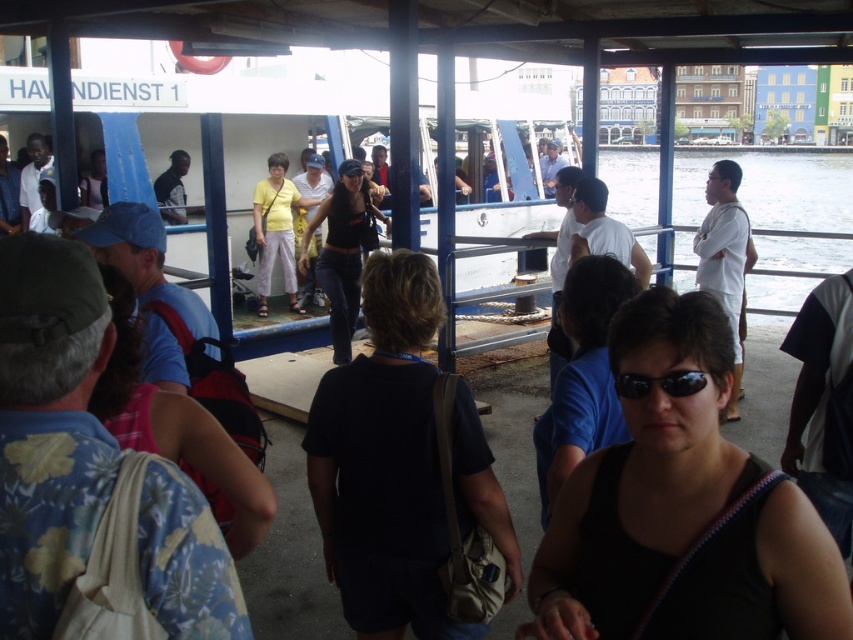
Question: Does floral shirt at left have a greater width compared to clear water at right?

Choices:
 (A) no
 (B) yes

Answer: (A)

Question: Which point is closer to the camera taking this photo?

Choices:
 (A) (113, 275)
 (B) (590, 275)
 (C) (630, 381)
 (D) (428, 324)

Answer: (C)

Question: Among these objects, which one is nearest to the camera?

Choices:
 (A) floral shirt at center
 (B) black plastic sunglasses at center

Answer: (B)

Question: Is yellow cotton shirt at center thinner than matte black shirt at upper left?

Choices:
 (A) yes
 (B) no

Answer: (B)

Question: Does floral shirt at left appear on the right side of black denim jeans at center?

Choices:
 (A) no
 (B) yes

Answer: (B)

Question: Considering the real-world distances, which object is closest to the floral shirt at left?

Choices:
 (A) matte blue cap at center
 (B) floral shirt at center

Answer: (B)